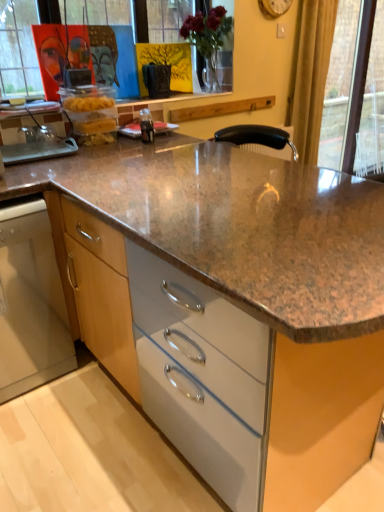
What do you see at coordinates (355, 91) in the screenshot? The width and height of the screenshot is (384, 512). I see `transparent glass door at upper right` at bounding box center [355, 91].

The height and width of the screenshot is (512, 384). What do you see at coordinates (31, 303) in the screenshot? I see `satin stainless steel dishwasher at lower left` at bounding box center [31, 303].

Identify the location of satin stainless steel dishwasher at lower left. This screenshot has height=512, width=384. (31, 303).

Locate an element on the screen. gold textured curtain at right is located at coordinates (310, 75).

Considering the sizes of objects transparent glass door at upper right and satin stainless steel dishwasher at lower left in the image provided, who is smaller, transparent glass door at upper right or satin stainless steel dishwasher at lower left?

transparent glass door at upper right.

Between transparent glass door at upper right and satin stainless steel dishwasher at lower left, which one is positioned behind?

transparent glass door at upper right is further from the camera.

From a real-world perspective, does transparent glass door at upper right sit lower than satin stainless steel dishwasher at lower left?

Incorrect, from a real-world perspective, transparent glass door at upper right is higher than satin stainless steel dishwasher at lower left.

From the image's perspective, is transparent glass door at upper right located beneath satin stainless steel dishwasher at lower left?

No, from the image's perspective, transparent glass door at upper right is not below satin stainless steel dishwasher at lower left.

Does transparent glass door at upper right have a lesser height compared to gold textured curtain at right?

No, transparent glass door at upper right is not shorter than gold textured curtain at right.

Looking at this image, from the image's perspective, relative to gold textured curtain at right, is transparent glass door at upper right above or below?

Clearly, from the image's perspective, transparent glass door at upper right is above gold textured curtain at right.

How different are the orientations of transparent glass door at upper right and gold textured curtain at right in degrees?

transparent glass door at upper right and gold textured curtain at right are facing 2.66 degrees away from each other.

Is point (349, 156) less distant than point (334, 23)?

That is False.

Can we say satin stainless steel dishwasher at lower left lies outside transparent glass door at upper right?

Yes, satin stainless steel dishwasher at lower left is located beyond the bounds of transparent glass door at upper right.

In the scene shown: From a real-world perspective, between satin stainless steel dishwasher at lower left and transparent glass door at upper right, who is vertically higher?

From a 3D spatial view, transparent glass door at upper right is above.

Does point (40, 321) appear closer or farther from the camera than point (357, 170)?

Point (40, 321) is positioned closer to the camera compared to point (357, 170).

In the scene shown: Which is more to the left, satin stainless steel dishwasher at lower left or transparent glass door at upper right?

From the viewer's perspective, satin stainless steel dishwasher at lower left appears more on the left side.

How different are the orientations of satin stainless steel dishwasher at lower left and gold textured curtain at right in degrees?

The angle between the facing direction of satin stainless steel dishwasher at lower left and the facing direction of gold textured curtain at right is 0.0262 degrees.

Could you tell me if satin stainless steel dishwasher at lower left is facing gold textured curtain at right?

No, satin stainless steel dishwasher at lower left is not facing towards gold textured curtain at right.

Considering the relative sizes of satin stainless steel dishwasher at lower left and gold textured curtain at right in the image provided, is satin stainless steel dishwasher at lower left thinner than gold textured curtain at right?

In fact, satin stainless steel dishwasher at lower left might be wider than gold textured curtain at right.

Does point (65, 340) come in front of point (319, 91)?

That is True.

Consider the image. From the image's perspective, is gold textured curtain at right above or below transparent glass door at upper right?

Based on their image positions, gold textured curtain at right is located beneath transparent glass door at upper right.

From a real-world perspective, is gold textured curtain at right positioned above or below transparent glass door at upper right?

In terms of real-world spatial position, gold textured curtain at right is above transparent glass door at upper right.

Considering the relative sizes of gold textured curtain at right and transparent glass door at upper right in the image provided, is gold textured curtain at right smaller than transparent glass door at upper right?

Indeed, gold textured curtain at right has a smaller size compared to transparent glass door at upper right.

Considering the sizes of gold textured curtain at right and satin stainless steel dishwasher at lower left in the image, is gold textured curtain at right bigger or smaller than satin stainless steel dishwasher at lower left?

Clearly, gold textured curtain at right is smaller in size than satin stainless steel dishwasher at lower left.

Is gold textured curtain at right situated inside satin stainless steel dishwasher at lower left or outside?

gold textured curtain at right cannot be found inside satin stainless steel dishwasher at lower left.

Which is less distant, [311,91] or [14,280]?

Point [311,91] appears to be farther away from the viewer than point [14,280].

From a real-world perspective, between gold textured curtain at right and satin stainless steel dishwasher at lower left, who is vertically higher?

In real-world perspective, gold textured curtain at right is above.

Find the location of a particular element. Image resolution: width=384 pixels, height=512 pixels. glass door that appears on the right of satin stainless steel dishwasher at lower left is located at coordinates (355, 91).

Find the location of `glass door behind the gold textured curtain at right`. glass door behind the gold textured curtain at right is located at coordinates (355, 91).

Estimate the real-world distances between objects in this image. Which object is closer to transparent glass door at upper right, satin stainless steel dishwasher at lower left or gold textured curtain at right?

gold textured curtain at right is positioned closer to the anchor transparent glass door at upper right.

From the image, which object appears to be farther from gold textured curtain at right, transparent glass door at upper right or satin stainless steel dishwasher at lower left?

The object further to gold textured curtain at right is satin stainless steel dishwasher at lower left.

From the image, which object appears to be nearer to transparent glass door at upper right, gold textured curtain at right or satin stainless steel dishwasher at lower left?

The object closer to transparent glass door at upper right is gold textured curtain at right.

Which object lies further to the anchor point gold textured curtain at right, satin stainless steel dishwasher at lower left or transparent glass door at upper right?

satin stainless steel dishwasher at lower left.

Based on their spatial positions, is gold textured curtain at right or transparent glass door at upper right further from satin stainless steel dishwasher at lower left?

transparent glass door at upper right.

From the image, which object appears to be nearer to satin stainless steel dishwasher at lower left, transparent glass door at upper right or gold textured curtain at right?

The object closer to satin stainless steel dishwasher at lower left is gold textured curtain at right.

Where is `curtain between satin stainless steel dishwasher at lower left and transparent glass door at upper right from left to right`? curtain between satin stainless steel dishwasher at lower left and transparent glass door at upper right from left to right is located at coordinates click(310, 75).